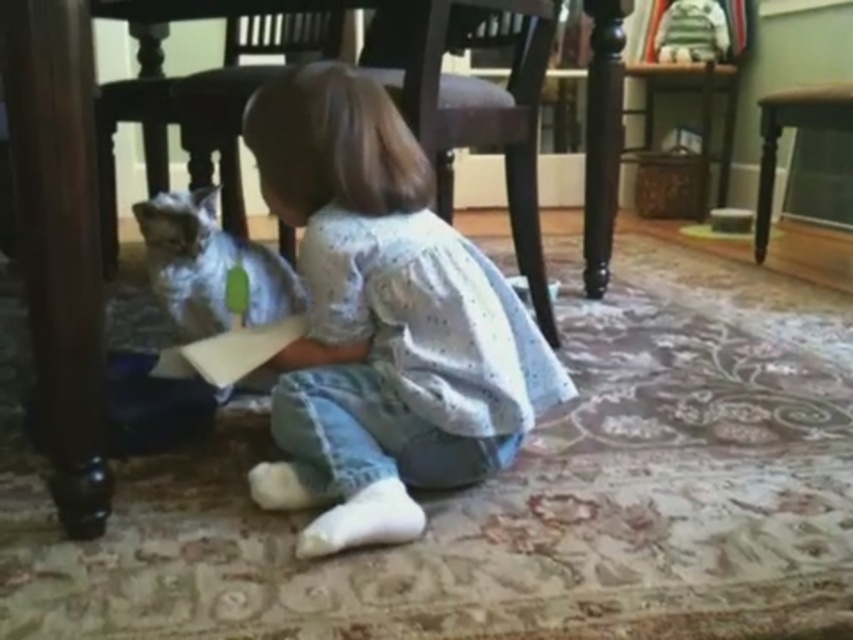
You are a parent trying to place a new plant pot between the brown wood chair at center and the wooden chair at center. According to the scene description, which chair should the plant pot be placed closer to in order to be positioned above the other chair?

The brown wood chair at center is below the wooden chair at center, so placing the plant pot closer to the wooden chair at center would position it above the brown wood chair at center.

You are a parent trying to place a new toy on the floor between the brown wood chair at center and the silvery fur cat at lower left. Considering their sizes, which object should you move to create more space?

The brown wood chair at center has a larger size compared to silvery fur cat at lower left, so you should move the brown wood chair at center to create more space.

You are standing at the entrance of the room and see the point marked at coordinates (473, 102). What object is located at that point?

The point at coordinates (473, 102) indicates the location of the brown wood chair at center.